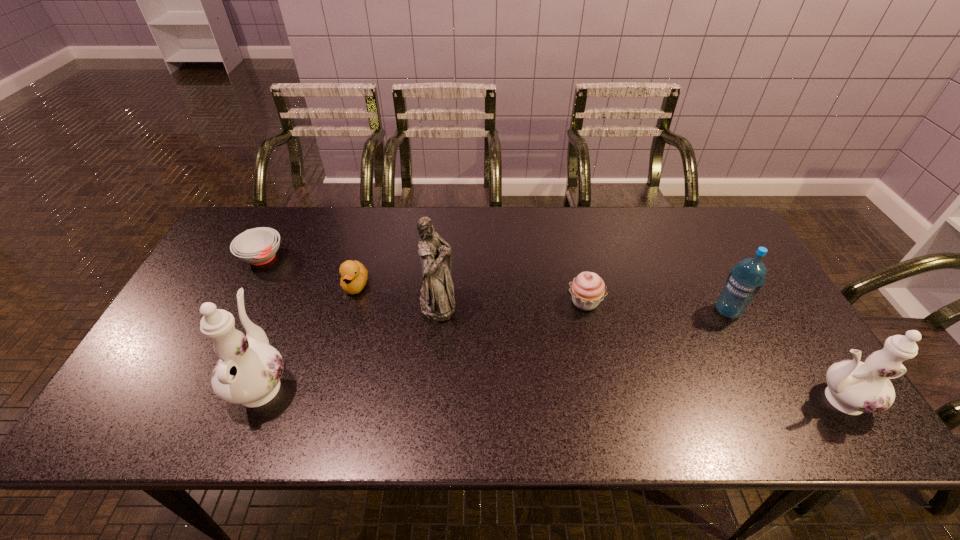
This screenshot has height=540, width=960. What are the coordinates of `vacant region located 0.160m on the front-facing side of the fourth object from left to right` in the screenshot? It's located at (514, 301).

At what (x,y) coordinates should I click in order to perform the action: click on object positioned at the far edge. Please return your answer as a coordinate pair (x, y). The height and width of the screenshot is (540, 960). Looking at the image, I should click on (257, 246).

Where is `object present at the left edge`? This screenshot has width=960, height=540. object present at the left edge is located at coordinates (257, 246).

Find the location of a particular element. The image size is (960, 540). chinaware that is at the right edge is located at coordinates (854, 387).

Identify the location of water bottle present at the right edge. Image resolution: width=960 pixels, height=540 pixels. (745, 280).

The image size is (960, 540). Find the location of `object that is at the far left corner`. object that is at the far left corner is located at coordinates (257, 246).

What are the coordinates of `object that is at the near right corner` in the screenshot? It's located at (854, 387).

You are a GUI agent. You are given a task and a screenshot of the screen. Output one action in this format:
    pyautogui.click(x=<x>, y=<y>)
    Task: Click on the vacant space at the far edge
    The image size is (960, 540).
    Given the screenshot: What is the action you would take?
    pyautogui.click(x=588, y=240)

In the image, there is a desktop. What are the coordinates of `vacant space at the near edge` in the screenshot? It's located at (x=313, y=389).

The height and width of the screenshot is (540, 960). Identify the location of blank space at the left edge of the desktop. (211, 262).